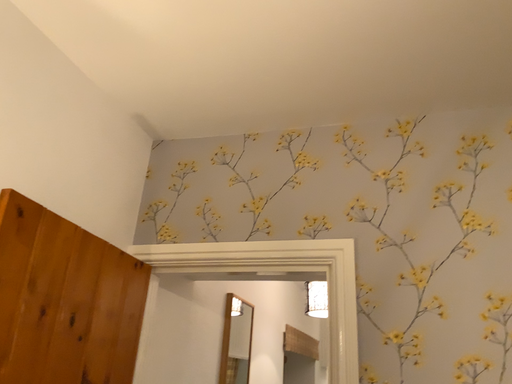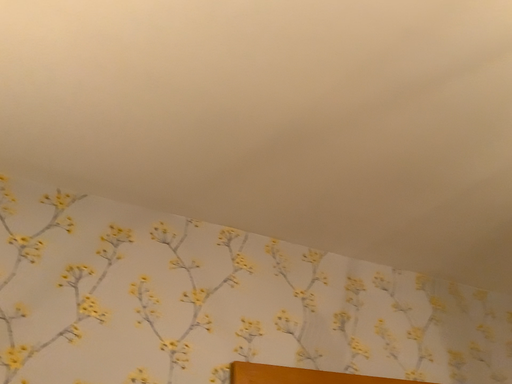
Question: Which way did the camera rotate in the video?

Choices:
 (A) rotated left
 (B) rotated right

Answer: (B)